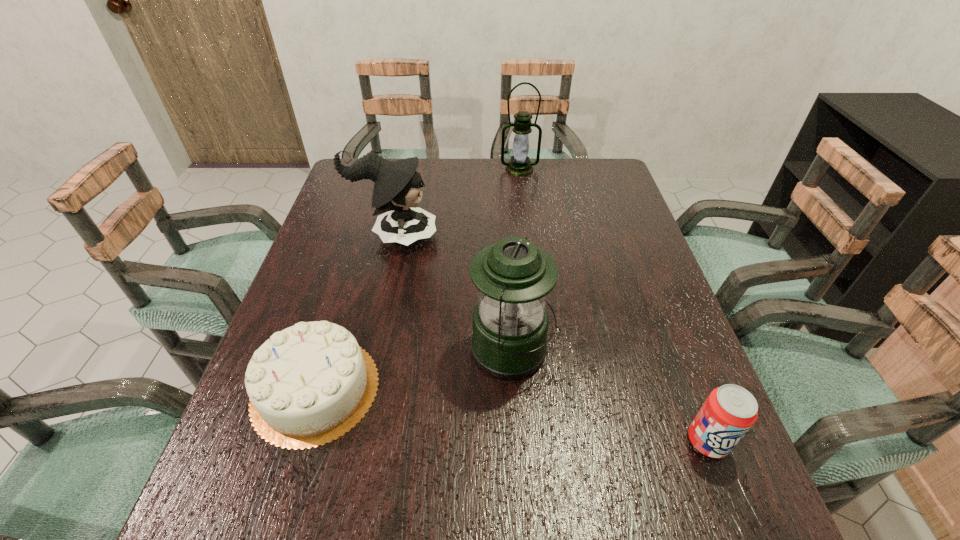
Identify which object is located as the fourth nearest to the farthest object. Please provide its 2D coordinates. Your answer should be formatted as a tuple, i.e. [(x, y)], where the tuple contains the x and y coordinates of a point satisfying the conditions above.

[(728, 413)]

Find the location of a particular element. The height and width of the screenshot is (540, 960). vacant area that satisfies the following two spatial constraints: 1. on the back side of the nearer lantern; 2. at the face of the second farthest object is located at coordinates (505, 237).

At what (x,y) coordinates should I click in order to perform the action: click on free region that satisfies the following two spatial constraints: 1. on the side where the farthest object emits light; 2. at the face of the second farthest object. Please return your answer as a coordinate pair (x, y). This screenshot has height=540, width=960. Looking at the image, I should click on (528, 237).